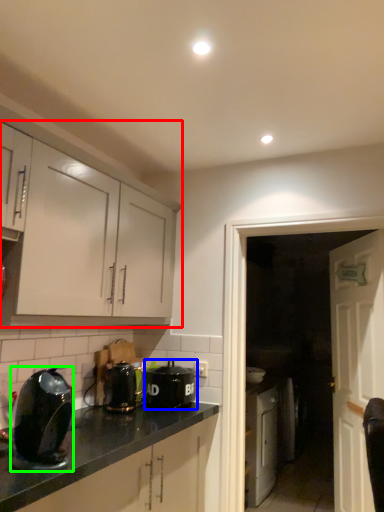
Question: Based on their relative distances, which object is nearer to cabinetry (highlighted by a red box)? Choose from kitchen appliance (highlighted by a blue box) and kitchen appliance (highlighted by a green box).

Choices:
 (A) kitchen appliance
 (B) kitchen appliance

Answer: (B)